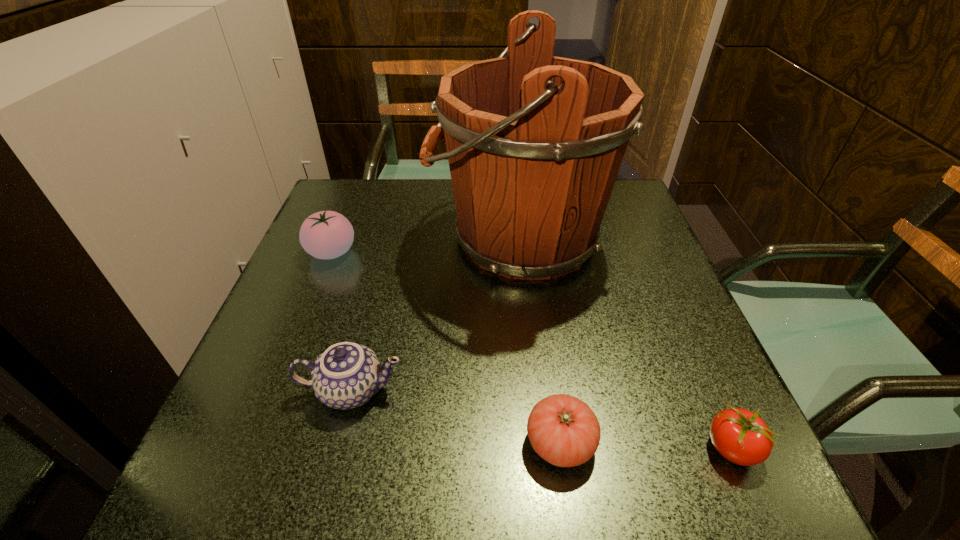
Find the location of a particular element. The width and height of the screenshot is (960, 540). the tallest object is located at coordinates (535, 142).

Identify the location of the tallest tomato. (327, 234).

Locate an element on the screen. Image resolution: width=960 pixels, height=540 pixels. the farthest tomato is located at coordinates (327, 234).

The width and height of the screenshot is (960, 540). I want to click on chinaware, so click(x=347, y=375).

Identify the location of the second tomato from left to right. This screenshot has height=540, width=960. (563, 430).

What are the coordinates of `the rightmost tomato` in the screenshot? It's located at (739, 435).

At what (x,y) coordinates should I click in order to perform the action: click on vacant area located with the handle on the side of the tallest object. Please return your answer as a coordinate pair (x, y). The image size is (960, 540). Looking at the image, I should click on click(x=388, y=238).

I want to click on free space located with the handle on the side of the tallest object, so click(x=322, y=238).

This screenshot has height=540, width=960. I want to click on free spot located 0.290m with the handle on the side of the tallest object, so click(x=309, y=238).

Locate an element on the screen. blank area located on the back of the leftmost tomato is located at coordinates (355, 193).